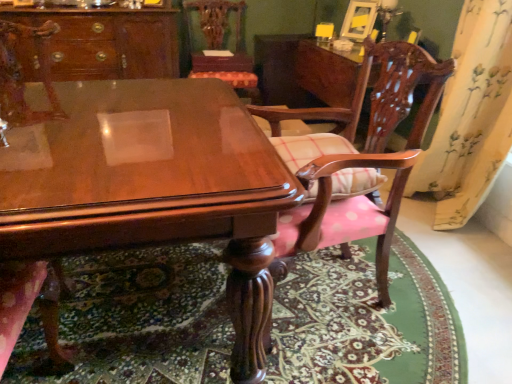
Question: Is wooden chair at upper center, the 1th chair from the back, closer to camera compared to yellow floral fabric at right?

Choices:
 (A) no
 (B) yes

Answer: (A)

Question: Does wooden chair at upper center, the third chair in the front-to-back sequence, have a lesser width compared to yellow floral fabric at right?

Choices:
 (A) no
 (B) yes

Answer: (A)

Question: Does wooden chair at upper center, the third chair in the front-to-back sequence, have a larger size compared to yellow floral fabric at right?

Choices:
 (A) yes
 (B) no

Answer: (B)

Question: Is wooden chair at upper center, the 1th chair from the back, looking in the opposite direction of yellow floral fabric at right?

Choices:
 (A) yes
 (B) no

Answer: (B)

Question: Can you confirm if wooden chair at upper center, the third chair in the front-to-back sequence, is shorter than yellow floral fabric at right?

Choices:
 (A) yes
 (B) no

Answer: (A)

Question: From the image's perspective, is wooden chair at upper center, the third chair in the front-to-back sequence, above yellow floral fabric at right?

Choices:
 (A) no
 (B) yes

Answer: (B)

Question: Can carpeted floor at lower center be found inside wooden chair at upper center, the 1th chair from the back?

Choices:
 (A) yes
 (B) no

Answer: (B)

Question: Is wooden chair at upper center, the third chair in the front-to-back sequence, not close to carpeted floor at lower center?

Choices:
 (A) yes
 (B) no

Answer: (A)

Question: From the image's perspective, is wooden chair at upper center, the 1th chair from the back, on top of carpeted floor at lower center?

Choices:
 (A) no
 (B) yes

Answer: (B)

Question: Can you confirm if wooden chair at upper center, the third chair in the front-to-back sequence, is positioned to the right of carpeted floor at lower center?

Choices:
 (A) yes
 (B) no

Answer: (B)

Question: Considering the relative sizes of wooden chair at upper center, the third chair in the front-to-back sequence, and carpeted floor at lower center in the image provided, is wooden chair at upper center, the third chair in the front-to-back sequence, taller than carpeted floor at lower center?

Choices:
 (A) no
 (B) yes

Answer: (B)

Question: Does wooden chair at upper center, the 1th chair from the back, appear on the left side of carpeted floor at lower center?

Choices:
 (A) no
 (B) yes

Answer: (B)

Question: Is carpeted floor at lower center to the left of polished wood chair at lower left, marked as the first chair in a front-to-back arrangement, from the viewer's perspective?

Choices:
 (A) no
 (B) yes

Answer: (A)